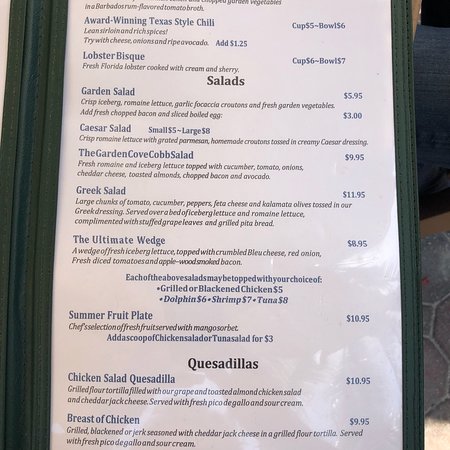
Find the location of `menu binder`. menu binder is located at coordinates (31, 101).